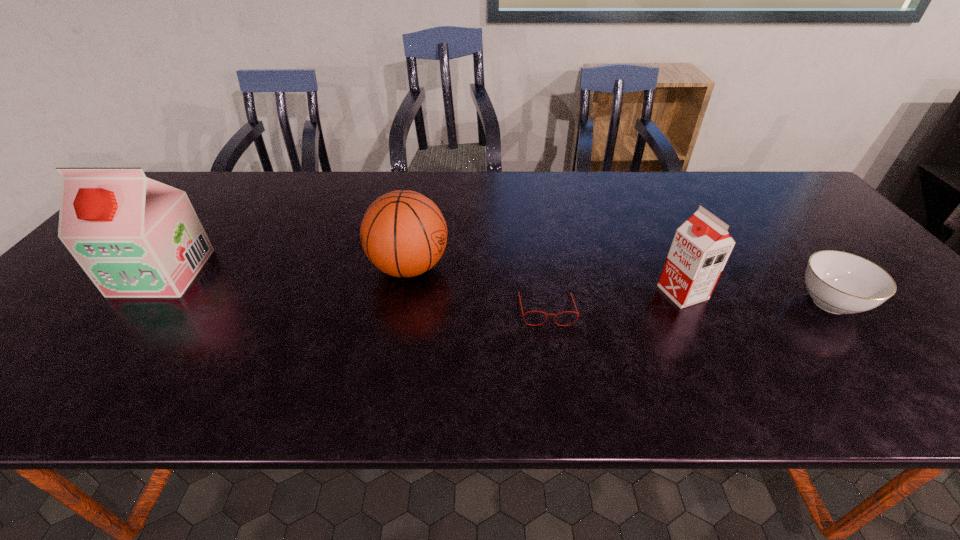
Find the location of a particular element. The height and width of the screenshot is (540, 960). free location located 0.070m on the right of the shorter soya milk is located at coordinates (734, 292).

Find the location of a particular element. The image size is (960, 540). free space located 0.350m on the back of the fourth object from right to left is located at coordinates (425, 178).

Where is `free space located on the back of the rightmost object`? free space located on the back of the rightmost object is located at coordinates (800, 266).

At what (x,y) coordinates should I click in order to perform the action: click on vacant space located on the face of the third object from right to left. Please return your answer as a coordinate pair (x, y). Looking at the image, I should click on (555, 363).

At what (x,y) coordinates should I click in order to perform the action: click on object present at the left edge. Please return your answer as a coordinate pair (x, y). Looking at the image, I should click on (133, 236).

Locate an element on the screen. This screenshot has width=960, height=540. object at the right edge is located at coordinates (838, 282).

This screenshot has height=540, width=960. Find the location of `vacant space at the far edge of the desktop`. vacant space at the far edge of the desktop is located at coordinates (x=661, y=191).

In the image, there is a desktop. Where is `vacant area at the near edge`? vacant area at the near edge is located at coordinates (773, 395).

In the image, there is a desktop. Where is `vacant space at the left edge`? The image size is (960, 540). vacant space at the left edge is located at coordinates (62, 326).

The image size is (960, 540). In order to click on vacant point at the right edge in this screenshot , I will do `click(814, 225)`.